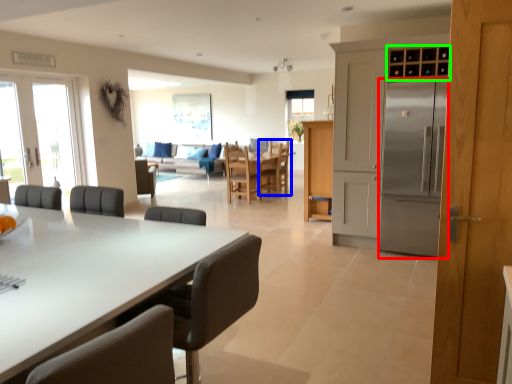
Question: Based on their relative distances, which object is farther from refrigerator (highlighted by a red box)? Choose from chair (highlighted by a blue box) and cabinetry (highlighted by a green box).

Choices:
 (A) chair
 (B) cabinetry

Answer: (A)